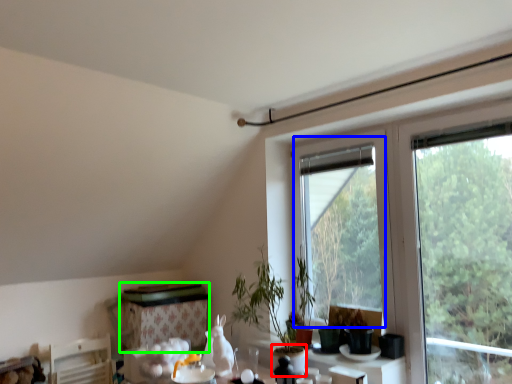
Question: Which is nearer to the glass vase (highlighted by a red box)? bay window (highlighted by a blue box) or table (highlighted by a green box).

Choices:
 (A) bay window
 (B) table

Answer: (B)